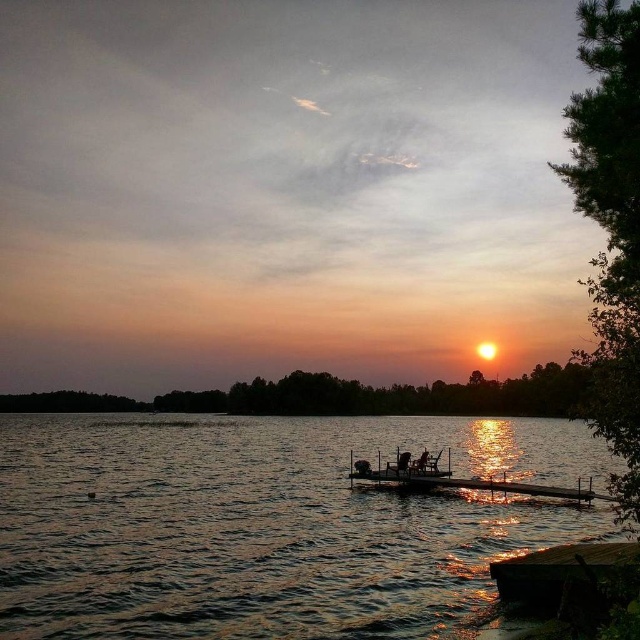
Which is above, glistening water at center or wooden dock at lower right?

wooden dock at lower right is above.

Does glistening water at center lie behind wooden dock at lower right?

Yes, glistening water at center is further from the viewer.

Does point (152, 609) come behind point (557, 556)?

No, (152, 609) is closer to viewer.

You are a GUI agent. You are given a task and a screenshot of the screen. Output one action in this format:
    pyautogui.click(x=<x>, y=<y>)
    Task: Click on the glistening water at center
    
    Given the screenshot: What is the action you would take?
    pyautogui.click(x=268, y=524)